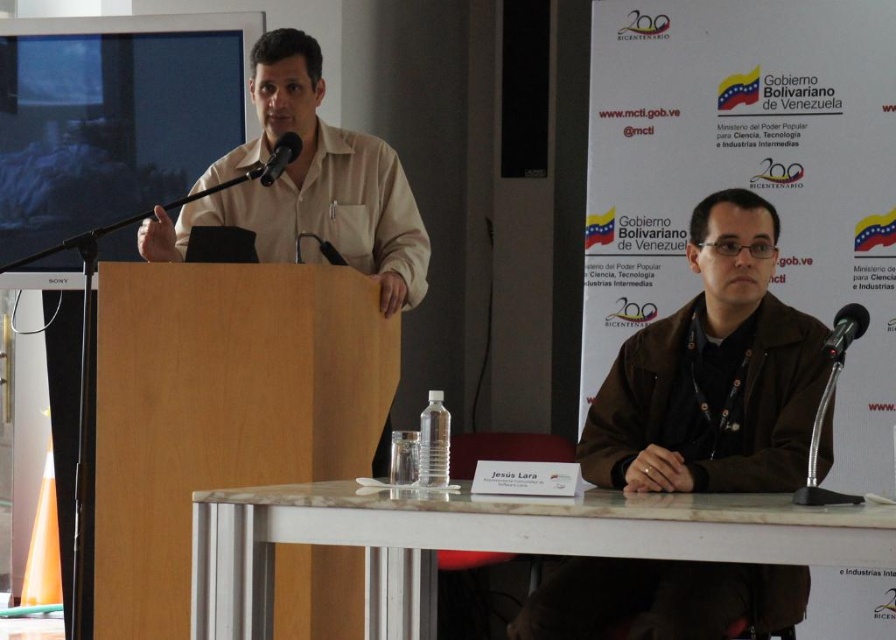
Is brown leather jacket at center smaller than white marble table at lower center?

No.

Is brown leather jacket at center positioned in front of white marble table at lower center?

No, it is not.

This screenshot has height=640, width=896. I want to click on brown leather jacket at center, so click(713, 372).

You are a GUI agent. You are given a task and a screenshot of the screen. Output one action in this format:
    pyautogui.click(x=<x>, y=<y>)
    Task: Click on the brown leather jacket at center
    The width and height of the screenshot is (896, 640).
    Given the screenshot: What is the action you would take?
    pyautogui.click(x=713, y=372)

In the scene shown: Does black metallic microphone at right have a lesser height compared to metallic black microphone at upper center?

Yes.

Measure the distance between black metallic microphone at right and camera.

The distance of black metallic microphone at right from camera is 1.92 meters.

Find the location of `black metallic microphone at right`. black metallic microphone at right is located at coordinates (845, 330).

In the scene shown: Is beige cotton shirt at center positioned in front of metallic black microphone at upper center?

Yes.

Between point (394, 307) and point (282, 144), which one is positioned behind?

Positioned behind is point (394, 307).

Locate an element on the screen. beige cotton shirt at center is located at coordinates (308, 186).